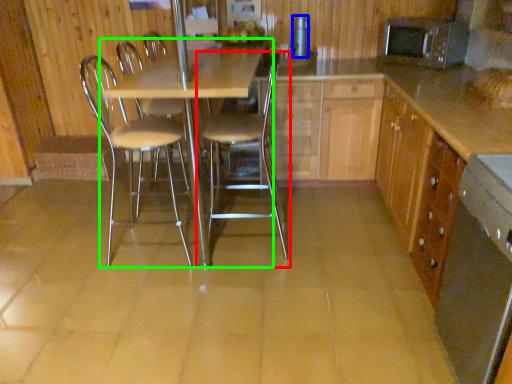
Question: Which object is the farthest from chair (highlighted by a red box)? Choose among these: appliance (highlighted by a blue box) or table (highlighted by a green box).

Choices:
 (A) appliance
 (B) table

Answer: (A)